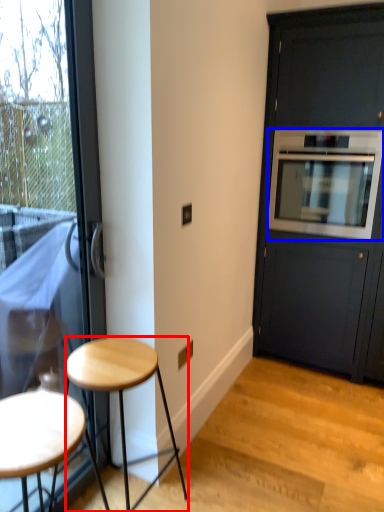
Question: Among these objects, which one is farthest to the camera, stool (highlighted by a red box) or oven (highlighted by a blue box)?

Choices:
 (A) stool
 (B) oven

Answer: (B)